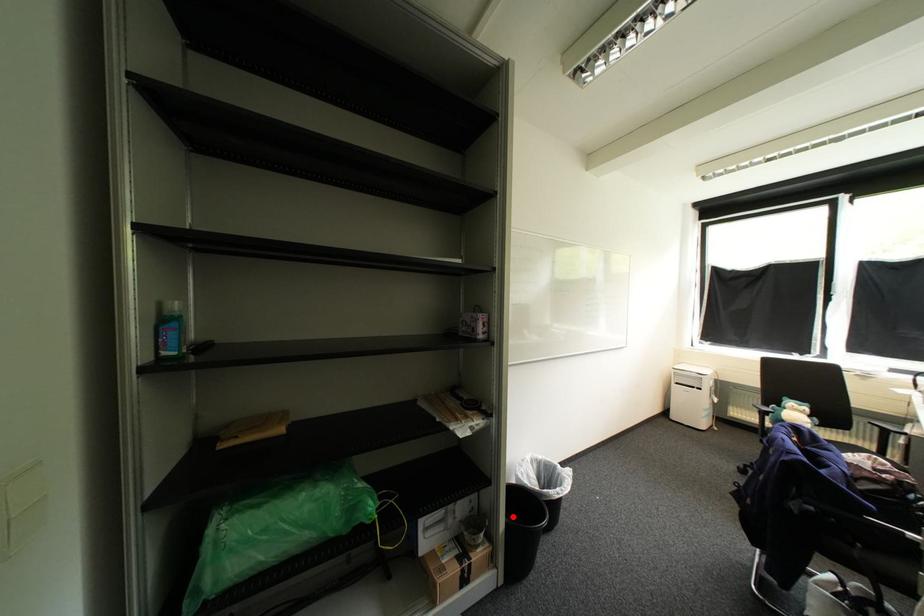
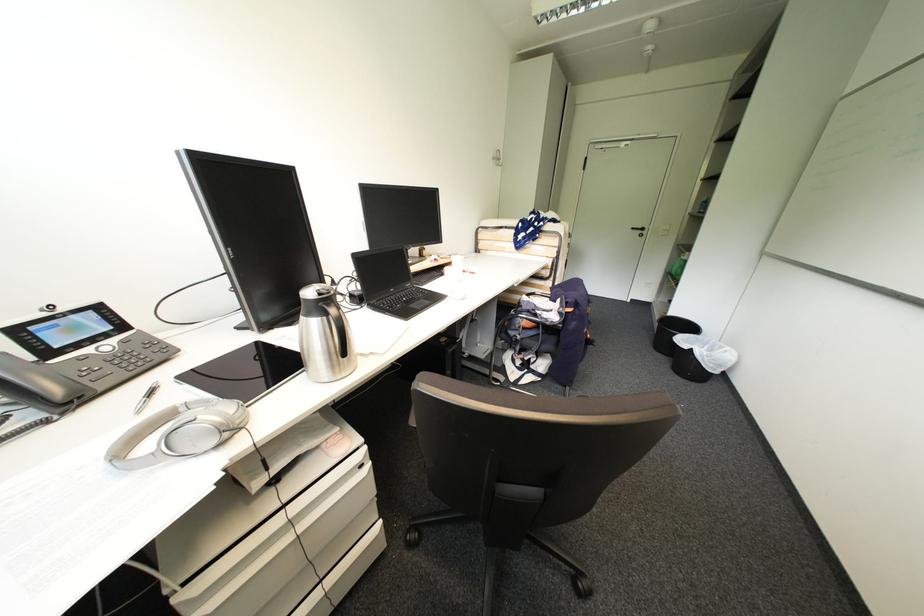
Question: I am providing you with two images of the same scene from different viewpoints. Given a red point in image1, look at the same physical point in image2. Is it:

Choices:
 (A) Closer to the viewpoint
 (B) Farther from the viewpoint

Answer: (A)